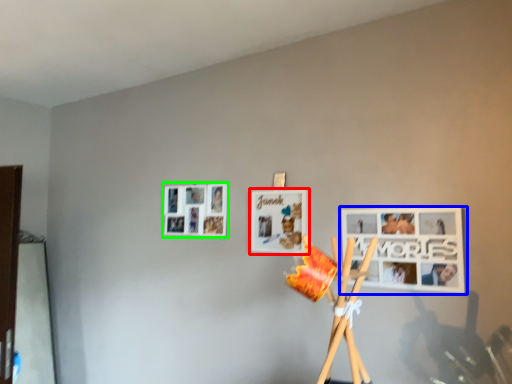
Question: Which is nearer to the picture frame (highlighted by a red box)? picture frame (highlighted by a blue box) or picture frame (highlighted by a green box).

Choices:
 (A) picture frame
 (B) picture frame

Answer: (B)